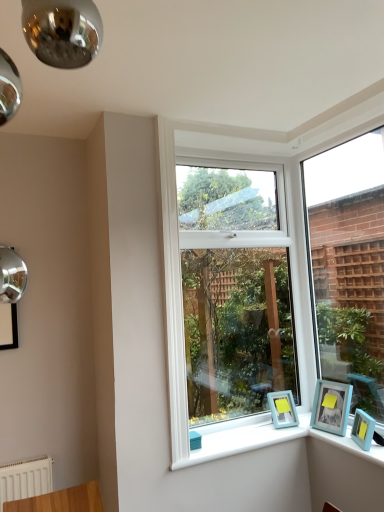
Question: Is clear glass window at right, arranged as the second window when viewed from the left, situated inside light blue plastic picture frame at lower right, the second picture frame viewed from the right, or outside?

Choices:
 (A) inside
 (B) outside

Answer: (B)

Question: Considering the positions of clear glass window at right, which is counted as the 1th window, starting from the right, and light blue plastic picture frame at lower right, which ranks as the second picture frame in left-to-right order, in the image, is clear glass window at right, which is counted as the 1th window, starting from the right, taller or shorter than light blue plastic picture frame at lower right, which ranks as the second picture frame in left-to-right order,?

Choices:
 (A) tall
 (B) short

Answer: (A)

Question: Based on their relative distances, which object is farther from the light blue plastic picture frame at lower right, which ranks as the second picture frame in left-to-right order?

Choices:
 (A) clear glass window at right, arranged as the second window when viewed from the left
 (B) white plastic window at center, arranged as the 1th window when viewed from the left
 (C) light blue plastic picture frame at lower right, the first picture frame in the right-to-left sequence
 (D) teal matte picture frame at lower right, which appears as the third picture frame when viewed from the right

Answer: (B)

Question: Which object is the closest to the white plastic window at center, arranged as the 1th window when viewed from the left?

Choices:
 (A) teal matte picture frame at lower right, the 1th picture frame positioned from the left
 (B) light blue plastic picture frame at lower right, which ranks as the second picture frame in left-to-right order
 (C) clear glass window at right, which is counted as the 1th window, starting from the right
 (D) light blue plastic picture frame at lower right, the first picture frame in the right-to-left sequence

Answer: (C)